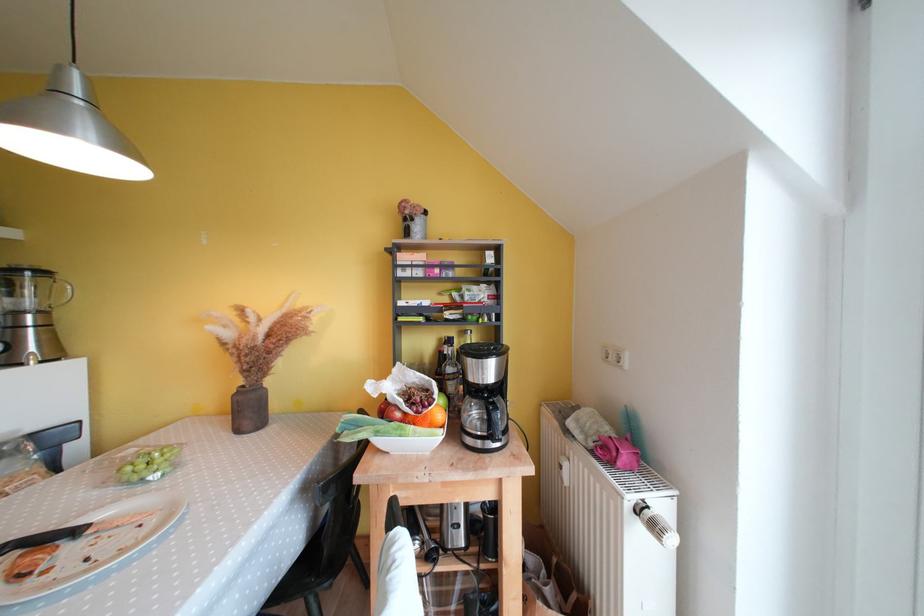
Find the location of `glass coffee pot`. glass coffee pot is located at coordinates (30, 314).